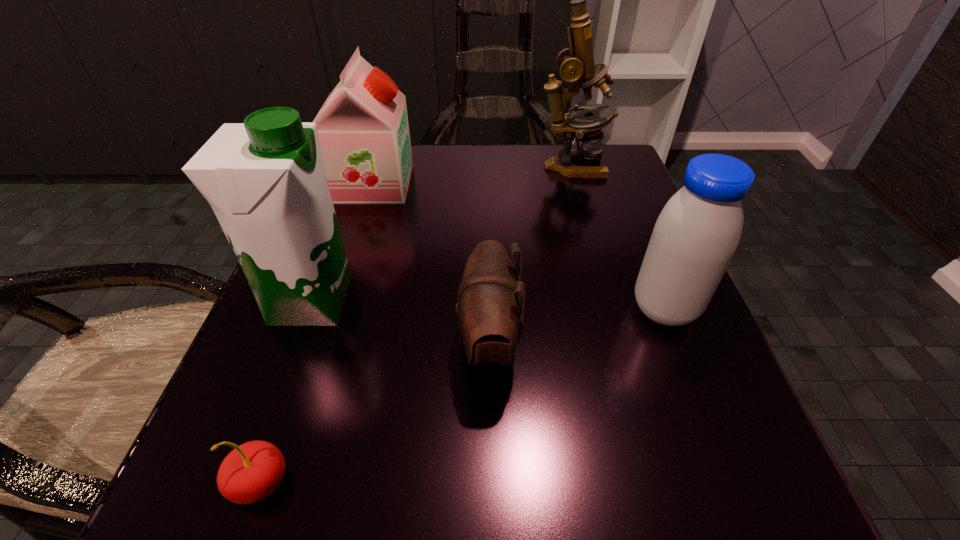
Identify the location of vacant region at the far right corner of the desktop. (618, 191).

You are a GUI agent. You are given a task and a screenshot of the screen. Output one action in this format:
    pyautogui.click(x=<x>, y=<y>)
    Task: Click on the vacant region between the farthest soya milk and the shortest object
    This screenshot has height=540, width=960.
    Given the screenshot: What is the action you would take?
    pyautogui.click(x=317, y=333)

I want to click on empty space between the third object from right to left and the microscope, so click(530, 254).

You are a GUI agent. You are given a task and a screenshot of the screen. Output one action in this format:
    pyautogui.click(x=<x>, y=<y>)
    Task: Click on the blank region between the microscope and the farthest soya milk
    The image size is (960, 540).
    Given the screenshot: What is the action you would take?
    pyautogui.click(x=472, y=174)

The image size is (960, 540). I want to click on vacant area between the microscope and the pouch, so click(530, 254).

The height and width of the screenshot is (540, 960). I want to click on free space between the microscope and the rightmost soya milk, so click(617, 238).

The width and height of the screenshot is (960, 540). In order to click on free spot between the pouch and the microscope in this screenshot , I will do `click(530, 254)`.

Locate an element on the screen. The image size is (960, 540). free point between the rightmost soya milk and the microscope is located at coordinates (617, 238).

Where is `empty location between the microscope and the cherry`? empty location between the microscope and the cherry is located at coordinates (417, 325).

Identify the location of free space between the microscope and the third object from right to left. The width and height of the screenshot is (960, 540). (530, 254).